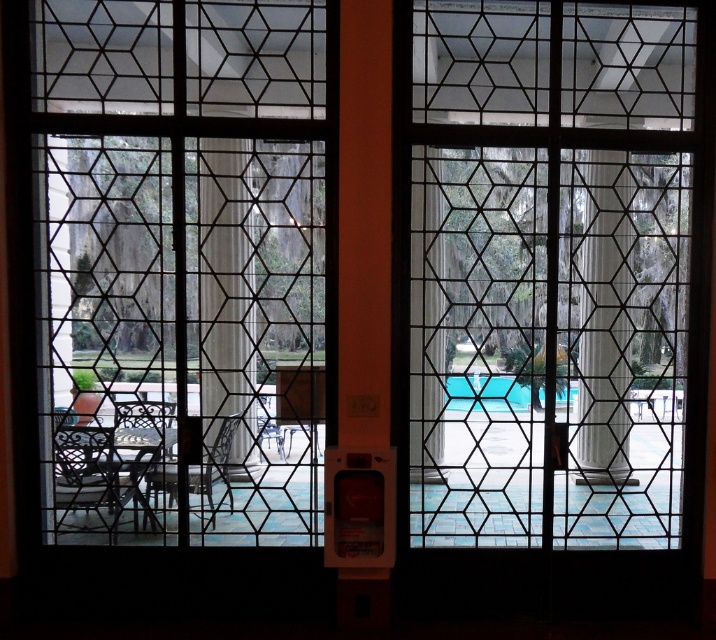
Question: Can you confirm if clear glass window at center is positioned to the right of blue glossy pool at center?

Choices:
 (A) no
 (B) yes

Answer: (A)

Question: Which point is closer to the camera?

Choices:
 (A) clear glass window at center
 (B) blue glossy pool at center

Answer: (A)

Question: Which point is farther to the camera?

Choices:
 (A) (500, 381)
 (B) (42, 214)

Answer: (A)

Question: Among these points, which one is nearest to the camera?

Choices:
 (A) (159, 428)
 (B) (490, 390)

Answer: (A)

Question: Is clear glass window at center further to the viewer compared to blue glossy pool at center?

Choices:
 (A) no
 (B) yes

Answer: (A)

Question: Does clear glass window at center appear on the right side of blue glossy pool at center?

Choices:
 (A) yes
 (B) no

Answer: (B)